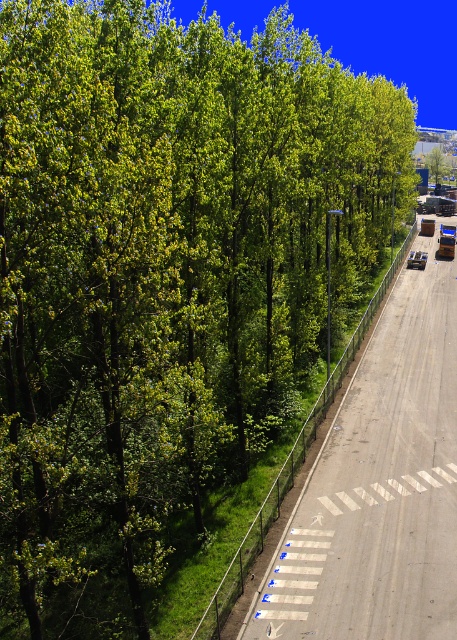
Can you confirm if asphalt road at center is positioned below green leafy tree at center?

Yes.

Does asphalt road at center come in front of green leafy tree at center?

Yes, it is.

Image resolution: width=457 pixels, height=640 pixels. Describe the element at coordinates (378, 490) in the screenshot. I see `asphalt road at center` at that location.

Where is `asphalt road at center`? asphalt road at center is located at coordinates (378, 490).